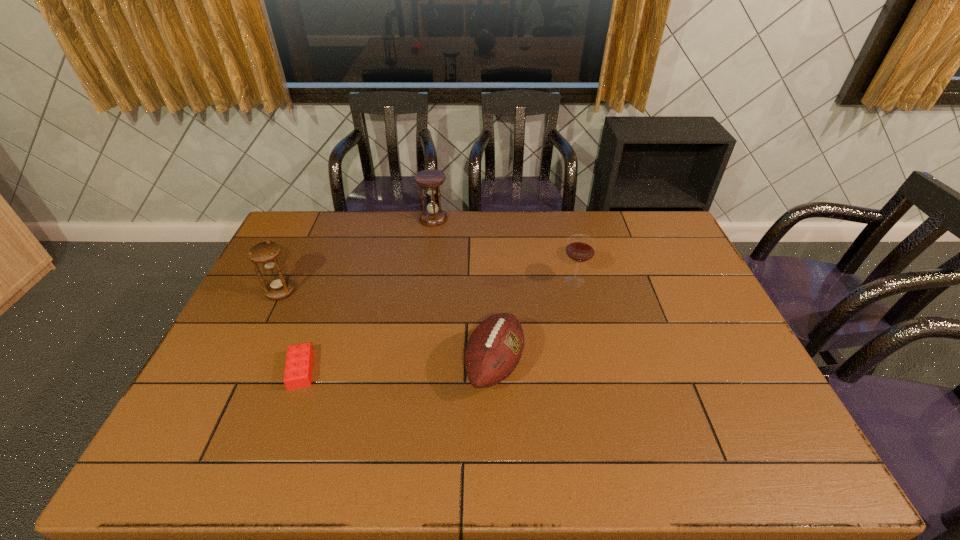
Where is `free spot between the leftmost object and the shortest object`? Image resolution: width=960 pixels, height=540 pixels. free spot between the leftmost object and the shortest object is located at coordinates (291, 331).

Locate which object is the closest to the right hourglass. Please provide its 2D coordinates. Your answer should be formatted as a tuple, i.e. [(x, y)], where the tuple contains the x and y coordinates of a point satisfying the conditions above.

[(580, 248)]

At what (x,y) coordinates should I click in order to perform the action: click on object that is the second closest to the wineglass. Please return your answer as a coordinate pair (x, y). Looking at the image, I should click on (433, 216).

You are a GUI agent. You are given a task and a screenshot of the screen. Output one action in this format:
    pyautogui.click(x=<x>, y=<y>)
    Task: Click on the vacant space that satisfies the following two spatial constraints: 1. on the front side of the shortest object; 2. on the left side of the nearer hourglass
    This screenshot has width=960, height=540.
    Given the screenshot: What is the action you would take?
    pyautogui.click(x=243, y=370)

Locate an element on the screen. free space in the image that satisfies the following two spatial constraints: 1. on the back side of the Lego; 2. on the left side of the rightmost object is located at coordinates (333, 281).

I want to click on vacant space that satisfies the following two spatial constraints: 1. on the front side of the farthest object; 2. on the left side of the fourth object from left to right, so click(x=414, y=366).